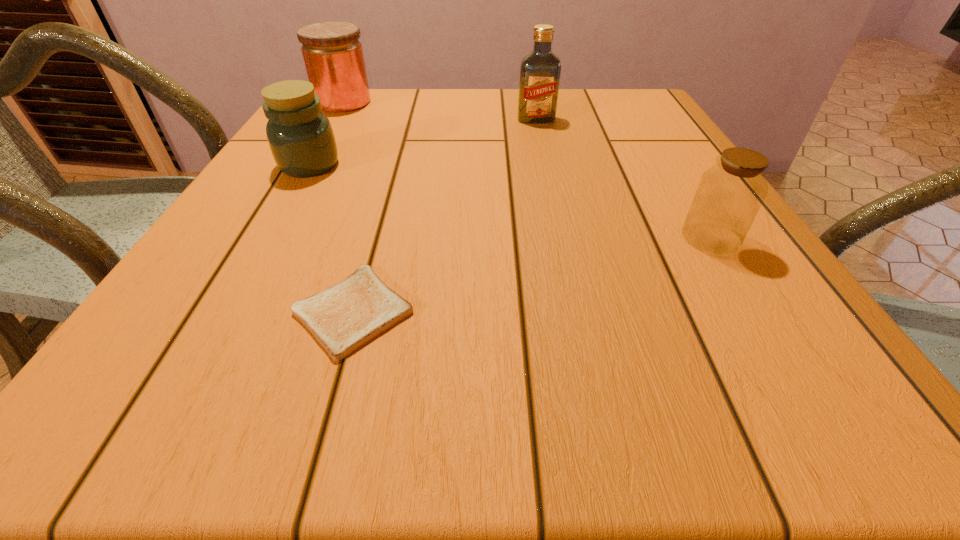
The height and width of the screenshot is (540, 960). Identify the location of free space between the nearest object and the second farthest object. (444, 215).

At what (x,y) coordinates should I click in order to perform the action: click on free point between the farthest object and the second object from right to left. Please return your answer as a coordinate pair (x, y). This screenshot has width=960, height=540. Looking at the image, I should click on (440, 111).

Where is `the closest object relative to the farthest jar`? the closest object relative to the farthest jar is located at coordinates (300, 136).

Point out which object is positioned as the nearest to the nearest jar. Please provide its 2D coordinates. Your answer should be formatted as a tuple, i.e. [(x, y)], where the tuple contains the x and y coordinates of a point satisfying the conditions above.

[(540, 70)]

Select which jar is the second closest to the fourth nearest object. Please provide its 2D coordinates. Your answer should be formatted as a tuple, i.e. [(x, y)], where the tuple contains the x and y coordinates of a point satisfying the conditions above.

[(300, 136)]

Choose which jar is the nearest neighbor to the fourth farthest object. Please provide its 2D coordinates. Your answer should be formatted as a tuple, i.e. [(x, y)], where the tuple contains the x and y coordinates of a point satisfying the conditions above.

[(300, 136)]

Identify the location of free space that satisfies the following two spatial constraints: 1. on the front-facing side of the rightmost jar; 2. on the right side of the tallest object. (563, 237).

I want to click on free space that satisfies the following two spatial constraints: 1. on the front side of the rightmost object; 2. on the left side of the farthest object, so click(265, 237).